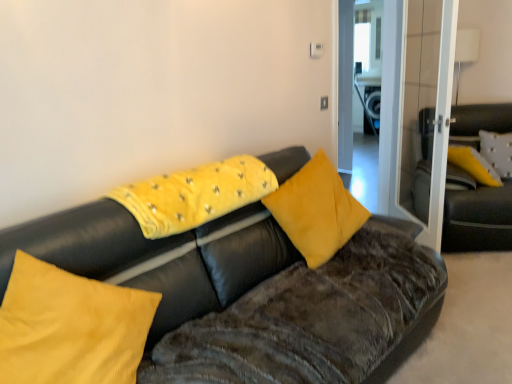
Question: Does yellow fabric pillow at upper right, which ranks as the first pillow in right-to-left order, contain velvet black couch at right, which is counted as the second studio couch, starting from the front?

Choices:
 (A) yes
 (B) no

Answer: (B)

Question: Does yellow fabric pillow at upper right, placed as the first pillow when sorted from back to front, have a smaller size compared to velvet black couch at right, which ranks as the 1th studio couch in back-to-front order?

Choices:
 (A) no
 (B) yes

Answer: (B)

Question: Is the position of yellow fabric pillow at upper right, acting as the 4th pillow starting from the left, less distant than that of velvet black couch at right, which ranks as the 1th studio couch in back-to-front order?

Choices:
 (A) no
 (B) yes

Answer: (A)

Question: Considering the relative positions of yellow fabric pillow at upper right, placed as the 4th pillow when sorted from front to back, and velvet black couch at right, the second studio couch from the left, in the image provided, is yellow fabric pillow at upper right, placed as the 4th pillow when sorted from front to back, to the right of velvet black couch at right, the second studio couch from the left, from the viewer's perspective?

Choices:
 (A) yes
 (B) no

Answer: (A)

Question: Is yellow fabric pillow at upper right, which ranks as the first pillow in right-to-left order, outside of velvet black couch at right, which is counted as the second studio couch, starting from the front?

Choices:
 (A) no
 (B) yes

Answer: (A)

Question: Is velvet yellow pillow at center, the second pillow viewed from the back, situated inside velvet black couch at center, the second studio couch when ordered from right to left, or outside?

Choices:
 (A) outside
 (B) inside

Answer: (B)

Question: From their relative heights in the image, would you say velvet yellow pillow at center, positioned as the second pillow in right-to-left order, is taller or shorter than velvet black couch at center, positioned as the second studio couch in back-to-front order?

Choices:
 (A) short
 (B) tall

Answer: (A)

Question: In the image, is velvet yellow pillow at center, which is counted as the 3th pillow, starting from the left, positioned in front of or behind velvet black couch at center, the first studio couch from the left?

Choices:
 (A) front
 (B) behind

Answer: (B)

Question: From a real-world perspective, relative to velvet black couch at center, the second studio couch when ordered from right to left, is velvet yellow pillow at center, which is counted as the 3th pillow, starting from the left, vertically above or below?

Choices:
 (A) below
 (B) above

Answer: (B)

Question: Is velvet black couch at center, positioned as the second studio couch in back-to-front order, wider or thinner than transparent glass door at right?

Choices:
 (A) thin
 (B) wide

Answer: (B)

Question: In the image, is velvet black couch at center, the second studio couch when ordered from right to left, on the left side or the right side of transparent glass door at right?

Choices:
 (A) right
 (B) left

Answer: (B)

Question: From the image's perspective, relative to transparent glass door at right, is velvet black couch at center, the second studio couch when ordered from right to left, above or below?

Choices:
 (A) below
 (B) above

Answer: (A)

Question: In the image, is velvet black couch at center, positioned as the second studio couch in back-to-front order, positioned in front of or behind transparent glass door at right?

Choices:
 (A) front
 (B) behind

Answer: (A)

Question: Considering the positions of point (480, 140) and point (64, 372), is point (480, 140) closer or farther from the camera than point (64, 372)?

Choices:
 (A) closer
 (B) farther

Answer: (B)

Question: Considering the positions of yellow fabric pillow at upper right, which ranks as the first pillow in right-to-left order, and velvet yellow pillow at center, which ranks as the first pillow in front-to-back order, in the image, is yellow fabric pillow at upper right, which ranks as the first pillow in right-to-left order, wider or thinner than velvet yellow pillow at center, which ranks as the first pillow in front-to-back order,?

Choices:
 (A) thin
 (B) wide

Answer: (A)